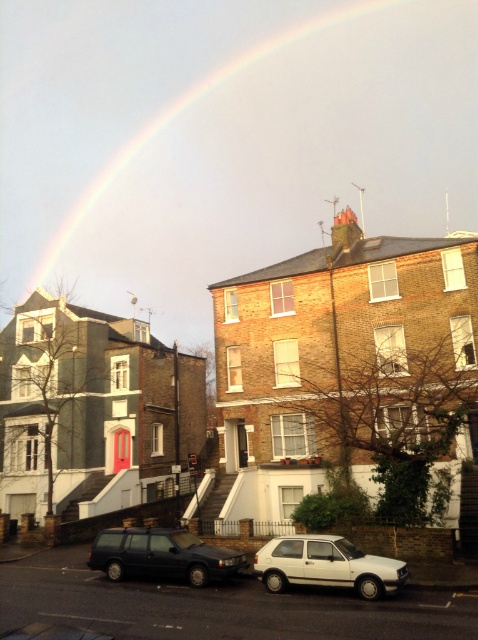
Question: Which of these objects is positioned closest to the matte black station wagon at center?

Choices:
 (A) rainbow at upper center
 (B) white matte hatchback at lower center

Answer: (B)

Question: Which point is farther from the camera taking this photo?

Choices:
 (A) (318, 20)
 (B) (325, 547)

Answer: (A)

Question: Among these points, which one is farthest from the camera?

Choices:
 (A) pos(19,40)
 (B) pos(399,572)

Answer: (A)

Question: Is white matte hatchback at lower center wider than matte black station wagon at center?

Choices:
 (A) yes
 (B) no

Answer: (B)

Question: Is rainbow at upper center to the left of white matte hatchback at lower center from the viewer's perspective?

Choices:
 (A) no
 (B) yes

Answer: (B)

Question: Is white matte hatchback at lower center below matte black station wagon at center?

Choices:
 (A) no
 (B) yes

Answer: (A)